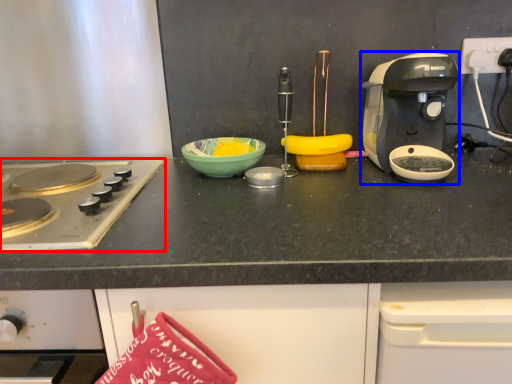
Question: Which object is further to the camera taking this photo, gas stove (highlighted by a red box) or coffee maker (highlighted by a blue box)?

Choices:
 (A) gas stove
 (B) coffee maker

Answer: (B)